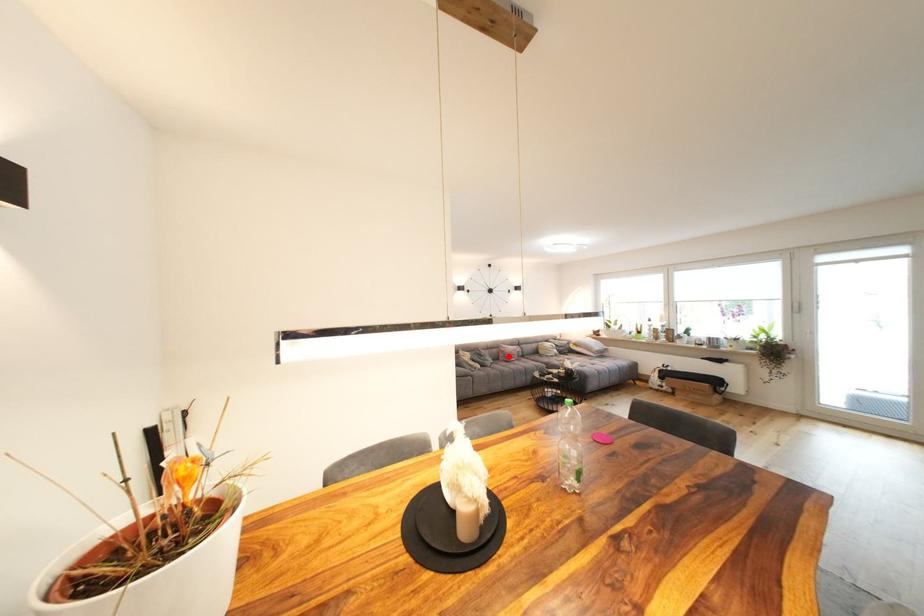
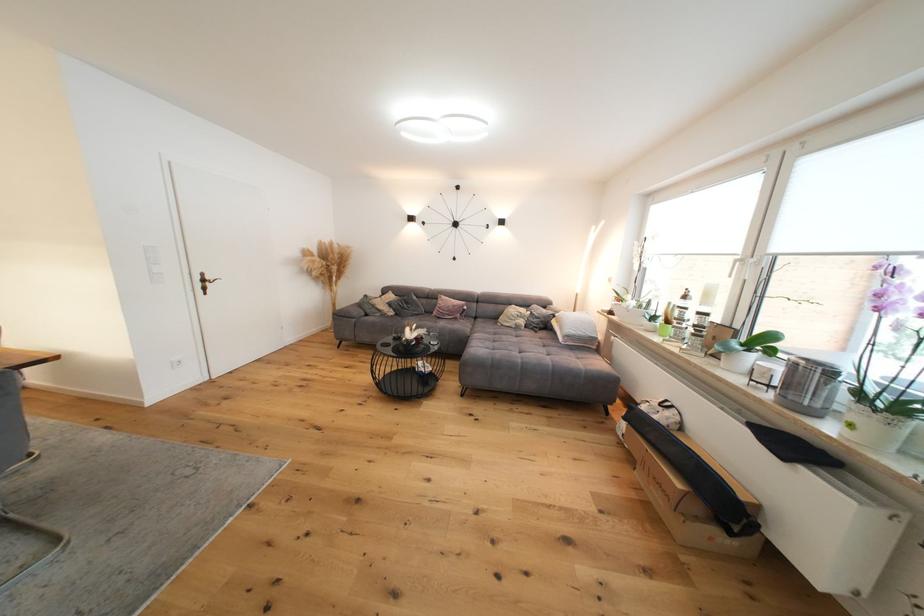
In the second image, find the point that corresponds to the highlighted location in the first image.

(444, 310)